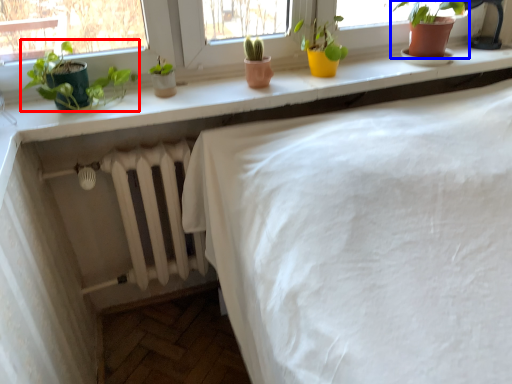
Question: Which of the following is the closest to the observer, houseplant (highlighted by a red box) or houseplant (highlighted by a blue box)?

Choices:
 (A) houseplant
 (B) houseplant

Answer: (A)